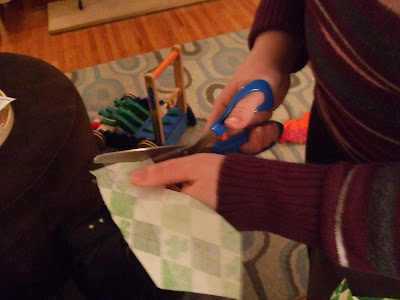
At what (x,y) coordinates should I click in order to perform the action: click on toy. Please return your answer as a coordinate pair (x, y). This screenshot has height=300, width=400. Looking at the image, I should click on (176, 127).